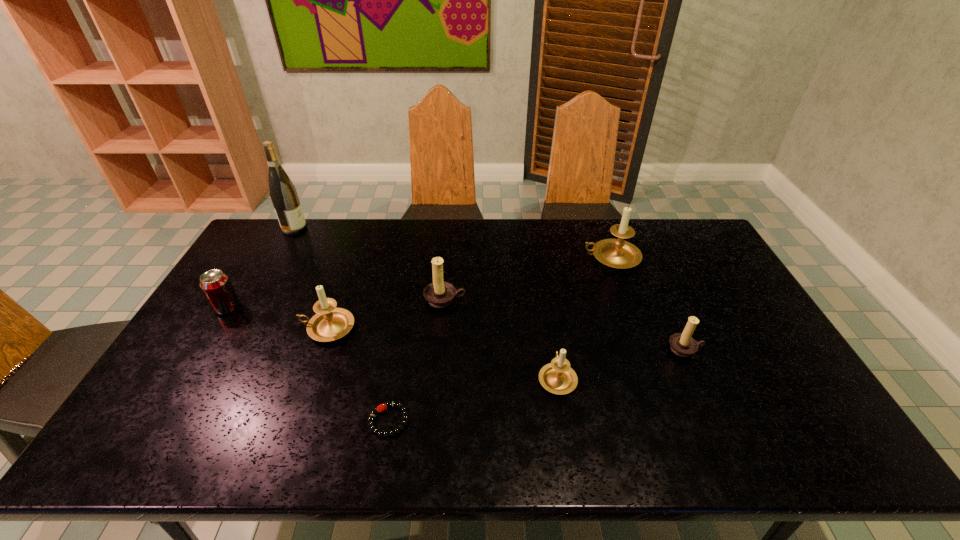
Identify the location of the second nearest object. (557, 377).

Locate an element on the screen. This screenshot has height=540, width=960. the right brown candle holder is located at coordinates [x=682, y=344].

You are a GUI agent. You are given a task and a screenshot of the screen. Output one action in this format:
    pyautogui.click(x=<x>, y=<y>)
    Task: Click on the nearer brown candle holder
    The height and width of the screenshot is (540, 960).
    Given the screenshot: What is the action you would take?
    pyautogui.click(x=682, y=344)

Locate an element on the screen. black bracelet is located at coordinates point(396,404).

Image resolution: width=960 pixels, height=540 pixels. In order to click on the nearest object in this screenshot , I will do `click(396, 404)`.

This screenshot has height=540, width=960. Find the location of `vacant region located on the front of the farthest object`. vacant region located on the front of the farthest object is located at coordinates (276, 260).

In order to click on vacant position located 0.090m with a handle on the side of the rightmost beige candle holder in this screenshot , I will do [x=557, y=258].

Locate an element on the screen. This screenshot has width=960, height=540. vacant area located with a handle on the side of the rightmost beige candle holder is located at coordinates (497, 258).

The width and height of the screenshot is (960, 540). Find the location of `blank space located with a handle on the side of the rightmost beige candle holder`. blank space located with a handle on the side of the rightmost beige candle holder is located at coordinates (483, 258).

Image resolution: width=960 pixels, height=540 pixels. Find the location of `vacant area located 0.200m with a handle on the side of the third object from left to right`. vacant area located 0.200m with a handle on the side of the third object from left to right is located at coordinates (232, 328).